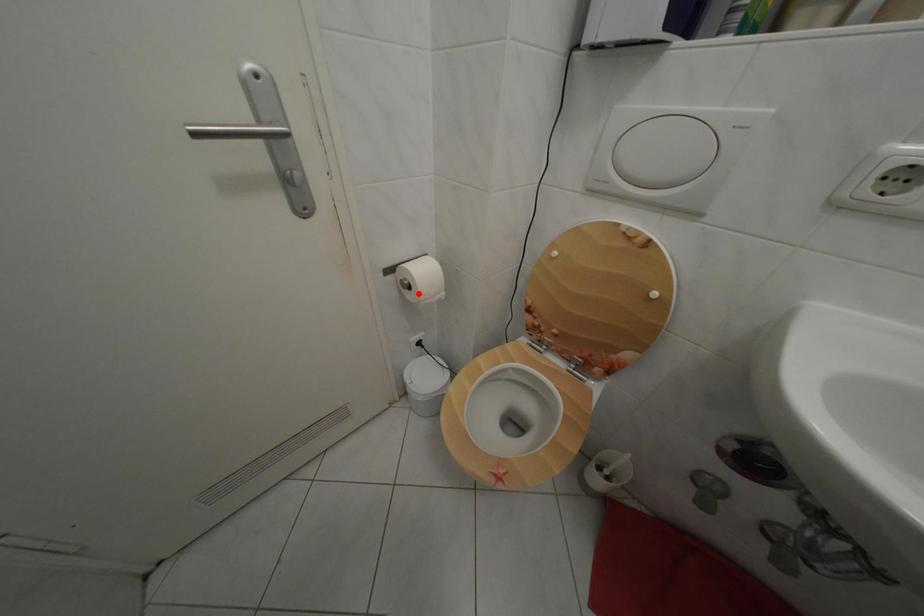
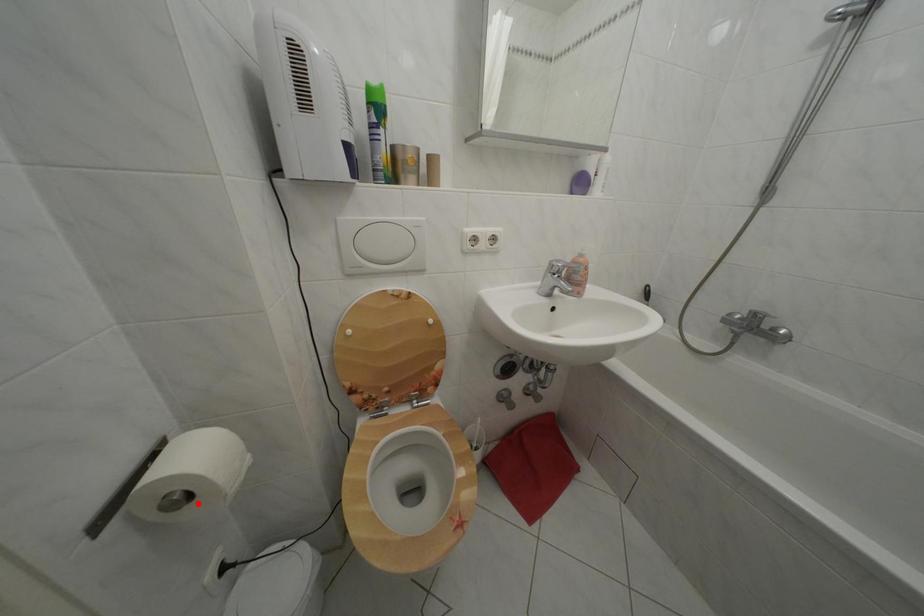
I am providing you with two images of the same scene from different viewpoints. A red point is marked on the first image and another point is marked on the second image. Do the highlighted points in image1 and image2 indicate the same real-world spot?

Yes